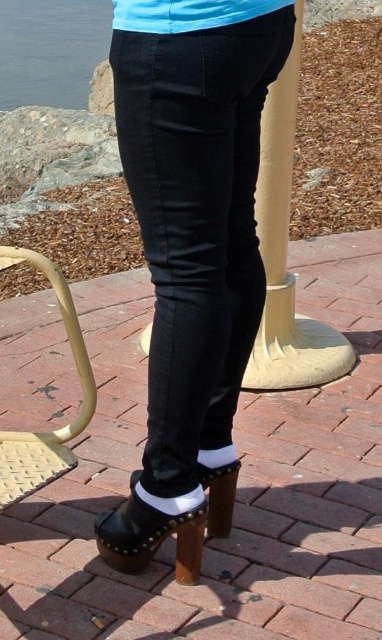
Is black leather clogs at lower center positioned before beige woven stool at lower left?

Yes.

Does black leather clogs at lower center lie behind beige woven stool at lower left?

No, black leather clogs at lower center is closer to the viewer.

Where is `black leather clogs at lower center`? This screenshot has height=640, width=382. black leather clogs at lower center is located at coordinates (192, 257).

You are a GUI agent. You are given a task and a screenshot of the screen. Output one action in this format:
    pyautogui.click(x=<x>, y=<y>)
    Task: Click on the black leather clogs at lower center
    The height and width of the screenshot is (640, 382).
    Given the screenshot: What is the action you would take?
    pyautogui.click(x=192, y=257)